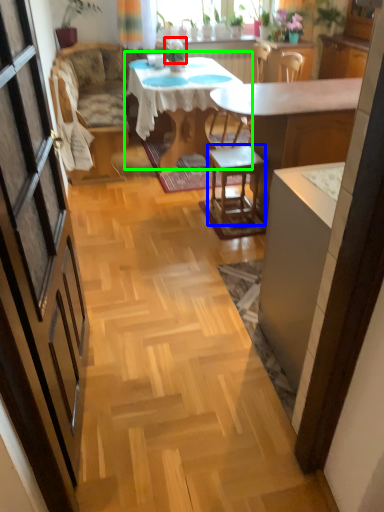
Question: Which is farther away from plant (highlighted by a red box)? stool (highlighted by a blue box) or kitchen & dining room table (highlighted by a green box)?

Choices:
 (A) stool
 (B) kitchen & dining room table

Answer: (A)